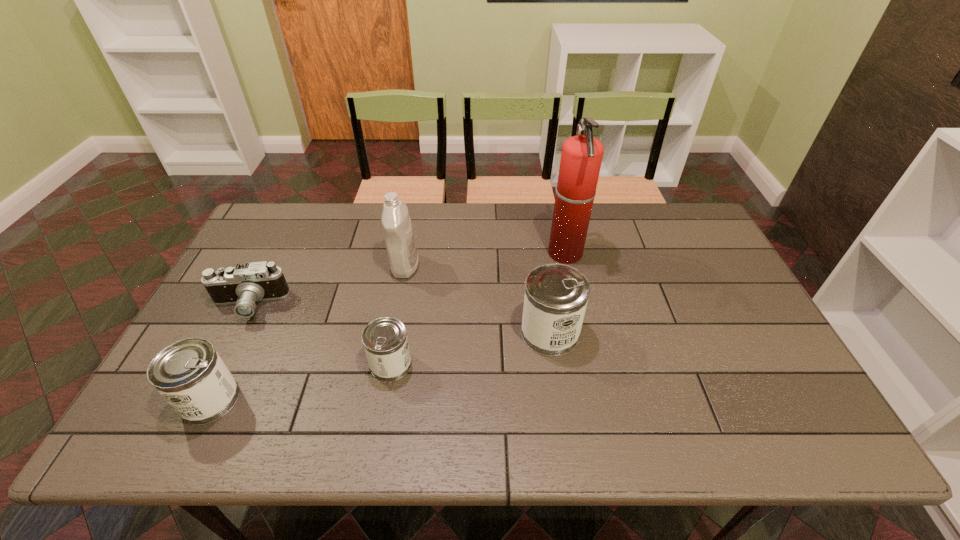
In order to click on free location located 0.350m on the back of the tallest can in this screenshot , I will do `click(536, 233)`.

Identify the location of free location located 0.050m on the front of the detergent. (400, 293).

This screenshot has height=540, width=960. Identify the location of vacant space located 0.160m with the nozzle and gauge on the tallest object. (497, 254).

Locate an element on the screen. This screenshot has width=960, height=540. blank space located 0.380m with the nozzle and gauge on the tallest object is located at coordinates (428, 254).

At what (x,y) coordinates should I click in order to perform the action: click on vacant area located 0.340m with the nozzle and gauge on the tallest object. Please return your answer as a coordinate pair (x, y). Looking at the image, I should click on [x=441, y=254].

Image resolution: width=960 pixels, height=540 pixels. In order to click on free point located 0.050m at the lens of the camera in this screenshot , I will do `click(231, 339)`.

Identify the location of object located at the far edge. (581, 157).

Find the location of a particular element. This screenshot has width=960, height=540. can situated at the left edge is located at coordinates (191, 376).

You are a GUI agent. You are given a task and a screenshot of the screen. Output one action in this format:
    pyautogui.click(x=<x>, y=<y>)
    Task: Click on the camera present at the left edge
    The height and width of the screenshot is (540, 960).
    Given the screenshot: What is the action you would take?
    pyautogui.click(x=243, y=285)

Locate an element on the screen. The width and height of the screenshot is (960, 540). object that is positioned at the near left corner is located at coordinates (191, 376).